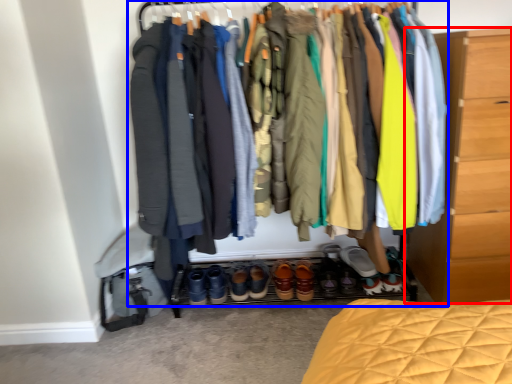
Question: Which of the following is the closest to the observer, chest of drawers (highlighted by a red box) or closet (highlighted by a blue box)?

Choices:
 (A) chest of drawers
 (B) closet

Answer: (B)